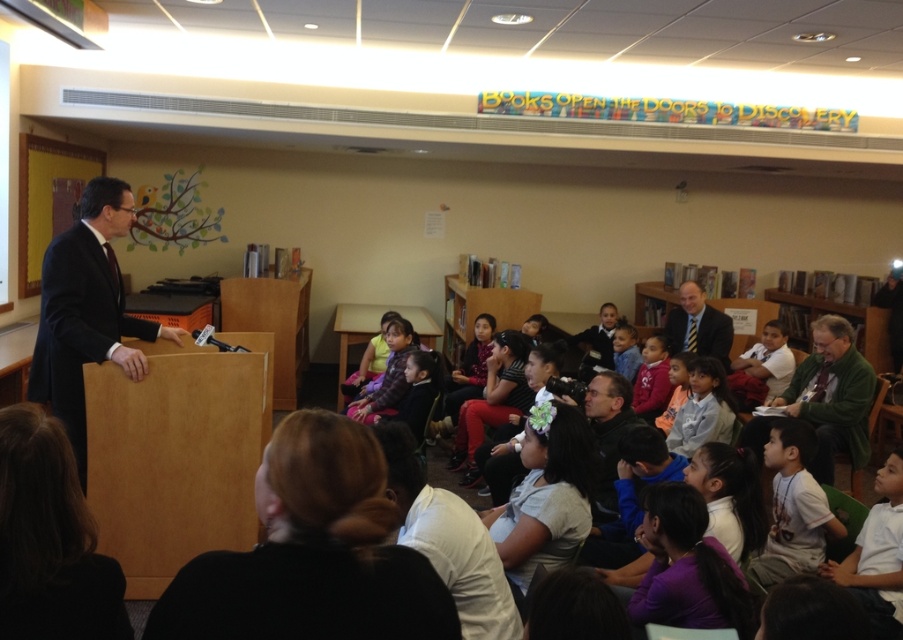
You are an event organizer who needs to arrange seating for a new speaker. The speaker prefers to stand where they can see both the green wool sweater at right and the matte pink hoodie at center. Based on their current positions, is this possible?

The green wool sweater at right is located below matte pink hoodie at center, meaning the speaker can see both as long as they are positioned in a way that allows viewing from above the green wool sweater at right towards the matte pink hoodie at center.

You are a photographer at the back of the room. You need to take a photo of the light brown hair at center and the green wool sweater at right. Which object should you focus on first to ensure both are in the frame?

The green wool sweater at right is located below light brown hair at center, so you should focus on the light brown hair at center first to ensure both are in the frame.